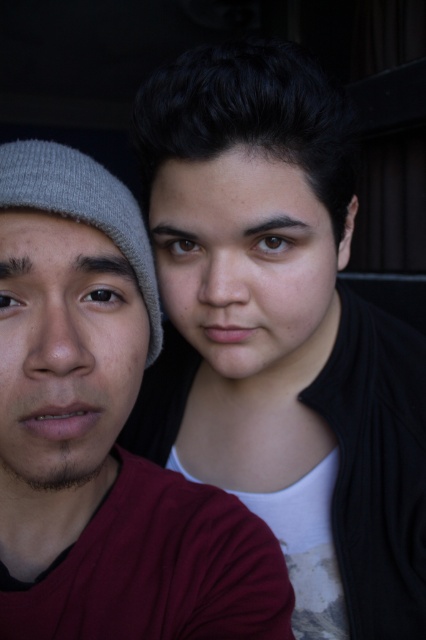
Question: Which object is closer to the camera taking this photo?

Choices:
 (A) matte gray beanie at left
 (B) gray knit beanie at left
 (C) matte black hair at upper center

Answer: (A)

Question: Does matte black hair at upper center have a smaller size compared to matte gray beanie at left?

Choices:
 (A) yes
 (B) no

Answer: (B)

Question: Which of these objects is positioned closest to the gray knit beanie at left?

Choices:
 (A) matte gray beanie at left
 (B) matte black hair at upper center

Answer: (A)

Question: In this image, where is matte black hair at upper center located relative to gray knit beanie at left?

Choices:
 (A) below
 (B) above

Answer: (A)

Question: Which of these objects is positioned closest to the matte black hair at upper center?

Choices:
 (A) matte gray beanie at left
 (B) gray knit beanie at left

Answer: (A)

Question: Is the position of matte black hair at upper center less distant than that of matte gray beanie at left?

Choices:
 (A) yes
 (B) no

Answer: (B)